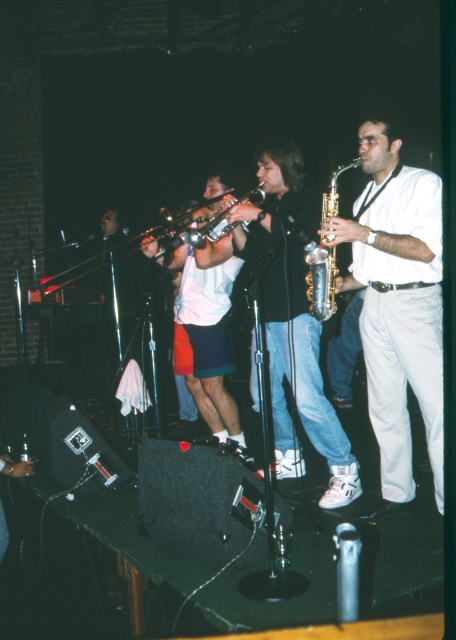
Is point (331, 284) positioned after point (195, 230)?

No, (331, 284) is closer to viewer.

Looking at this image, does shiny brass trumpet at center have a greater width compared to shiny silver trumpet at center?

No.

What do you see at coordinates (321, 280) in the screenshot? I see `shiny brass trumpet at center` at bounding box center [321, 280].

I want to click on shiny brass trumpet at center, so click(321, 280).

Is black matte jacket at center to the left of shiny silver trumpet at center from the viewer's perspective?

No, black matte jacket at center is not to the left of shiny silver trumpet at center.

Describe the element at coordinates (293, 320) in the screenshot. The image size is (456, 640). I see `black matte jacket at center` at that location.

The image size is (456, 640). In order to click on black matte jacket at center in this screenshot , I will do `click(293, 320)`.

Who is taller, white matte saxophone at center or black matte jacket at center?

black matte jacket at center

Based on the photo, who is more distant from viewer, (440,326) or (325,432)?

The point (325,432) is behind.

Is point (416, 346) positioned in front of point (285, 412)?

That is True.

In order to click on white matte saxophone at center in this screenshot , I will do `click(397, 307)`.